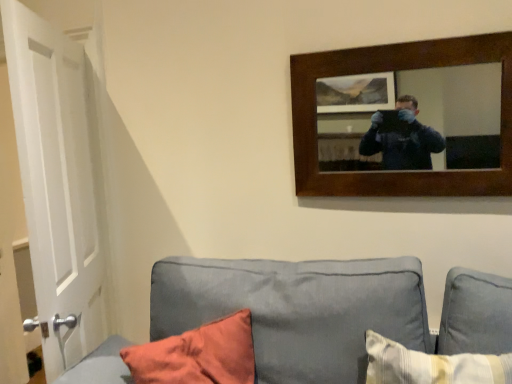
Question: Is gray fabric couch at lower center wider than white matte door at left?

Choices:
 (A) yes
 (B) no

Answer: (A)

Question: Are gray fabric couch at lower center and white matte door at left located far from each other?

Choices:
 (A) yes
 (B) no

Answer: (B)

Question: Does gray fabric couch at lower center have a smaller size compared to white matte door at left?

Choices:
 (A) yes
 (B) no

Answer: (B)

Question: Is gray fabric couch at lower center surrounding white matte door at left?

Choices:
 (A) yes
 (B) no

Answer: (B)

Question: Is gray fabric couch at lower center positioned behind white matte door at left?

Choices:
 (A) no
 (B) yes

Answer: (A)

Question: From the image's perspective, would you say gray fabric couch at lower center is shown under white matte door at left?

Choices:
 (A) yes
 (B) no

Answer: (A)

Question: Does wooden-framed mirror at upper right appear on the left side of gray fabric couch at lower center?

Choices:
 (A) yes
 (B) no

Answer: (B)

Question: Considering the relative positions of wooden-framed mirror at upper right and gray fabric couch at lower center in the image provided, is wooden-framed mirror at upper right behind gray fabric couch at lower center?

Choices:
 (A) no
 (B) yes

Answer: (B)

Question: Is wooden-framed mirror at upper right facing towards gray fabric couch at lower center?

Choices:
 (A) no
 (B) yes

Answer: (A)

Question: From the image's perspective, is wooden-framed mirror at upper right on gray fabric couch at lower center?

Choices:
 (A) yes
 (B) no

Answer: (A)

Question: Can gray fabric couch at lower center be found inside wooden-framed mirror at upper right?

Choices:
 (A) no
 (B) yes

Answer: (A)

Question: From a real-world perspective, is wooden-framed mirror at upper right below gray fabric couch at lower center?

Choices:
 (A) no
 (B) yes

Answer: (A)

Question: Is white matte door at left placed right next to gray fabric couch at lower center?

Choices:
 (A) yes
 (B) no

Answer: (B)